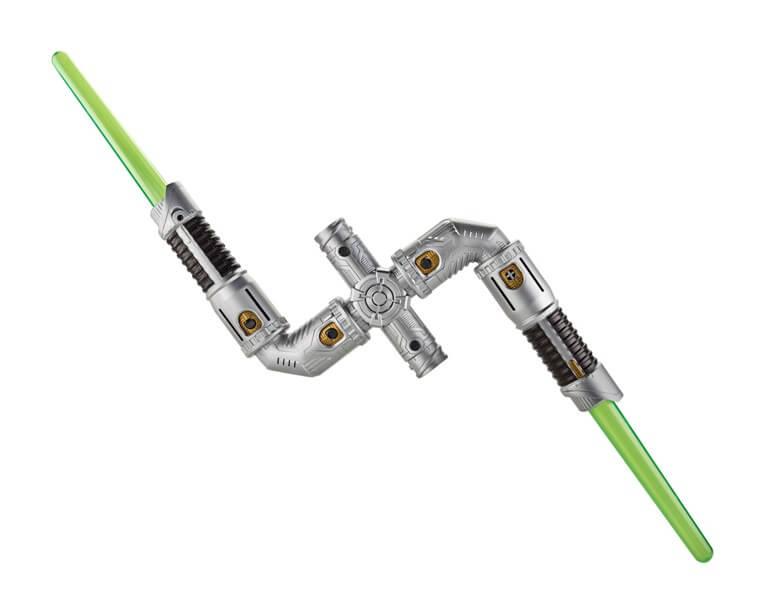
Where is `glass`? The width and height of the screenshot is (766, 600). glass is located at coordinates (650, 489), (146, 183).